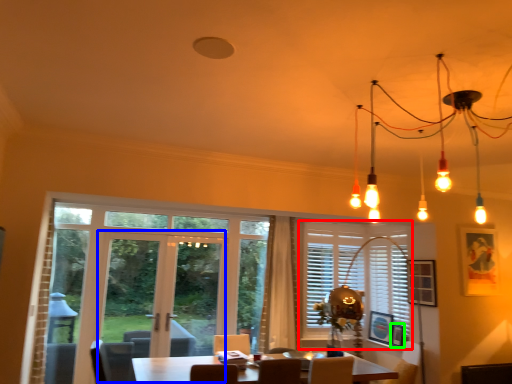
Question: Based on their relative distances, which object is farther from window (highlighted by a red box)? Choose from screen door (highlighted by a blue box) and picture frame (highlighted by a green box).

Choices:
 (A) screen door
 (B) picture frame

Answer: (A)